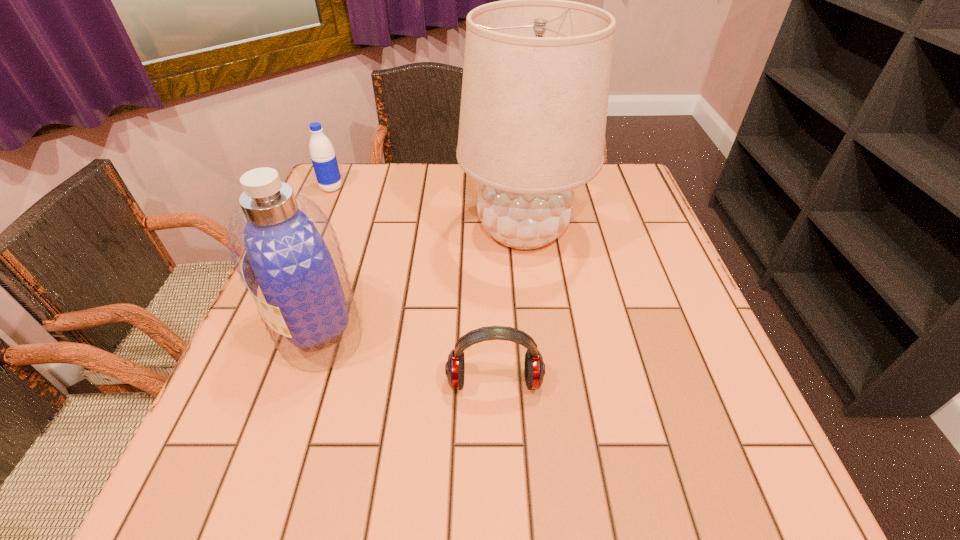
The height and width of the screenshot is (540, 960). In order to click on lampshade present at the far edge in this screenshot , I will do (x=536, y=76).

This screenshot has height=540, width=960. What are the coordinates of `water bottle that is at the far edge` in the screenshot? It's located at (323, 157).

Find the location of `cleansing agent present at the left edge`. cleansing agent present at the left edge is located at coordinates (282, 244).

Find the location of a particular element. This screenshot has width=960, height=540. water bottle at the left edge is located at coordinates (323, 157).

The width and height of the screenshot is (960, 540). Find the location of `object positioned at the far left corner`. object positioned at the far left corner is located at coordinates (323, 157).

At what (x,y) coordinates should I click in order to perform the action: click on vacant space at the far edge of the desktop. Please return your answer as a coordinate pair (x, y). Looking at the image, I should click on (411, 191).

Where is `vacant space at the near edge of the desktop`? The height and width of the screenshot is (540, 960). vacant space at the near edge of the desktop is located at coordinates (526, 501).

At what (x,y) coordinates should I click in order to perform the action: click on free spot at the left edge of the desktop. Please return your answer as a coordinate pair (x, y). Image resolution: width=960 pixels, height=540 pixels. Looking at the image, I should click on (237, 424).

In the image, there is a desktop. Find the location of `vacant region at the right edge`. vacant region at the right edge is located at coordinates (647, 321).

At what (x,y) coordinates should I click in order to perform the action: click on vacant space at the far left corner of the desktop. Please return your answer as a coordinate pair (x, y). The image size is (960, 540). Looking at the image, I should click on (365, 179).